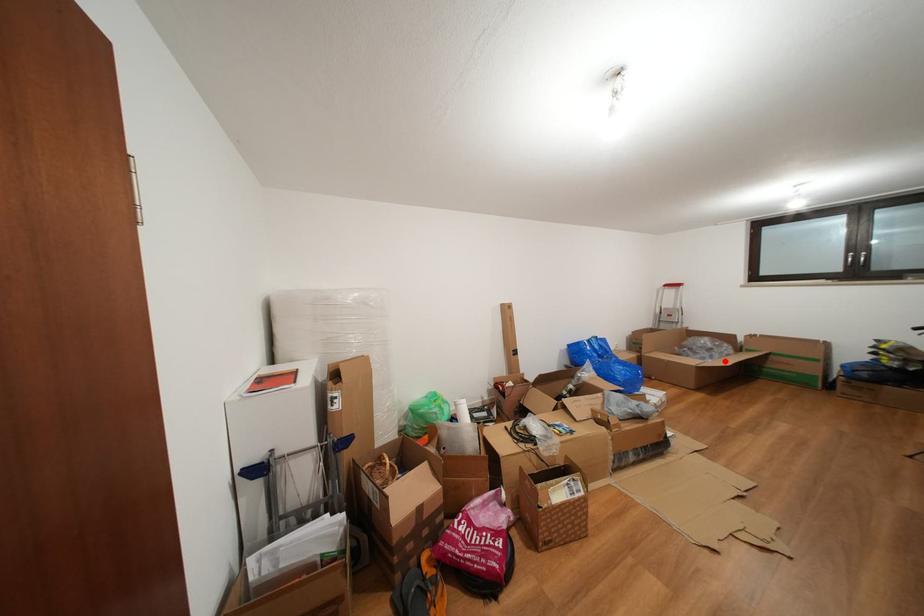
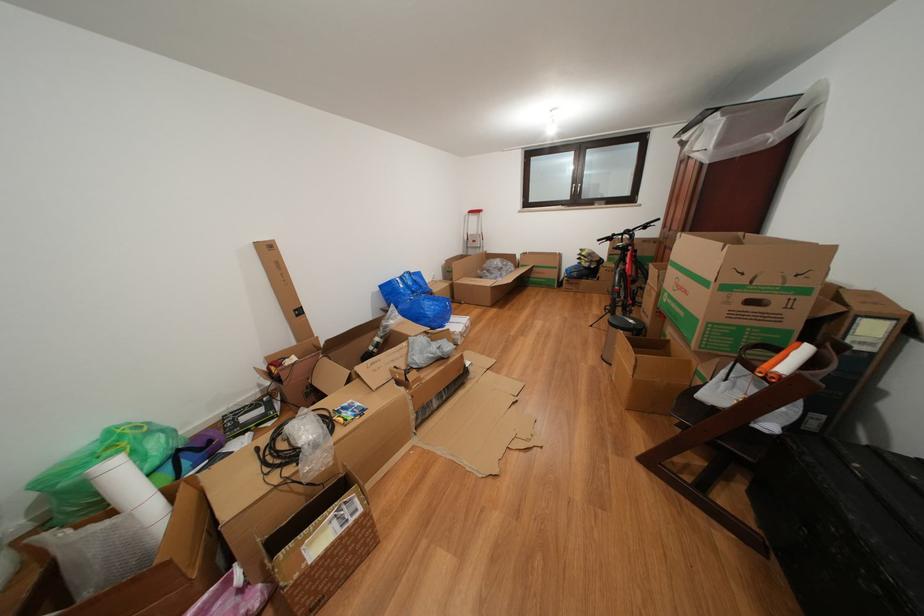
In the second image, find the point that corresponds to the highlighted location in the first image.

(513, 280)